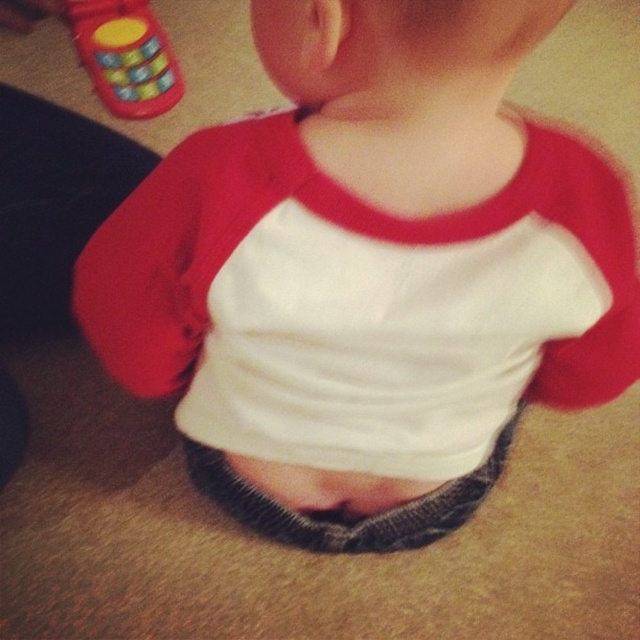
Is the position of rubberized plastic phone at upper left less distant than that of gray knitted fabric at center?

That is False.

Who is lower down, rubberized plastic phone at upper left or gray knitted fabric at center?

Positioned lower is gray knitted fabric at center.

Is point (74, 28) closer to viewer compared to point (259, 465)?

No, it is behind (259, 465).

At what (x,y) coordinates should I click in order to perform the action: click on rubberized plastic phone at upper left. Please return your answer as a coordinate pair (x, y). Looking at the image, I should click on (124, 54).